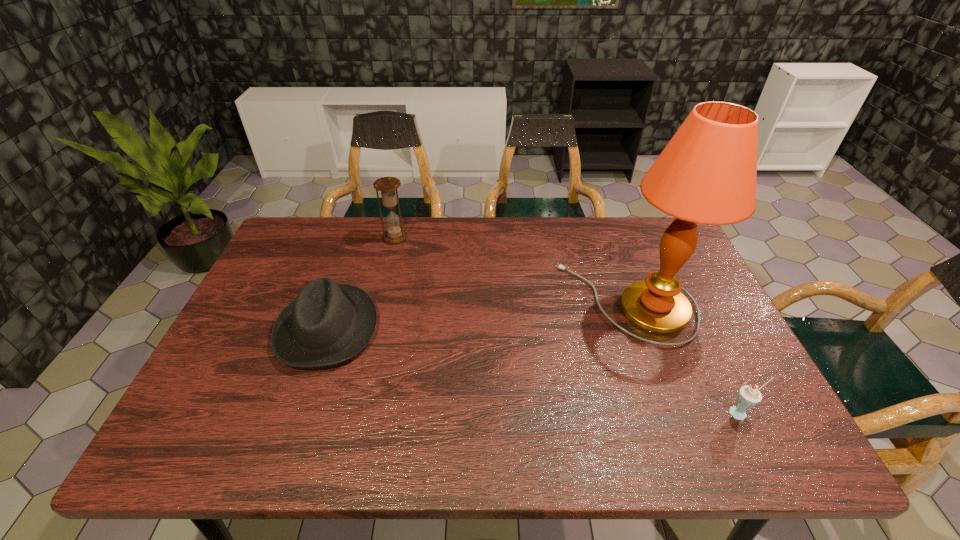
Where is `free space at the far right corner of the desktop`? free space at the far right corner of the desktop is located at coordinates (631, 241).

You are a GUI agent. You are given a task and a screenshot of the screen. Output one action in this format:
    pyautogui.click(x=<x>, y=<y>)
    Task: Click on the unoccupied area between the nearest object and the lamp
    
    Given the screenshot: What is the action you would take?
    pyautogui.click(x=684, y=358)

The height and width of the screenshot is (540, 960). In order to click on free space between the third shortest object and the tallest object in this screenshot , I will do `click(512, 270)`.

Find the location of `free space between the farthest object and the nearest object`. free space between the farthest object and the nearest object is located at coordinates (568, 325).

Identify the location of blank region between the fedora and the lamp. This screenshot has width=960, height=540. (478, 315).

At what (x,y) coordinates should I click in order to perform the action: click on free area in between the fedora and the lamp. Please return your answer as a coordinate pair (x, y). The height and width of the screenshot is (540, 960). Looking at the image, I should click on (478, 315).

You are a GUI agent. You are given a task and a screenshot of the screen. Output one action in this format:
    pyautogui.click(x=<x>, y=<y>)
    Task: Click on the free space between the milkshake and the farthest object
    The width and height of the screenshot is (960, 540).
    Given the screenshot: What is the action you would take?
    pyautogui.click(x=568, y=325)

You are a GUI agent. You are given a task and a screenshot of the screen. Output one action in this format:
    pyautogui.click(x=<x>, y=<y>)
    Task: Click on the vacant space in between the nearest object and the farthest object
    Image resolution: width=960 pixels, height=540 pixels.
    Given the screenshot: What is the action you would take?
    pyautogui.click(x=568, y=325)

Find the location of a particular element. The width and height of the screenshot is (960, 540). vacant point located between the nearest object and the tallest object is located at coordinates (684, 358).

Where is `free spot between the tallest object and the nearest object`? The image size is (960, 540). free spot between the tallest object and the nearest object is located at coordinates (684, 358).